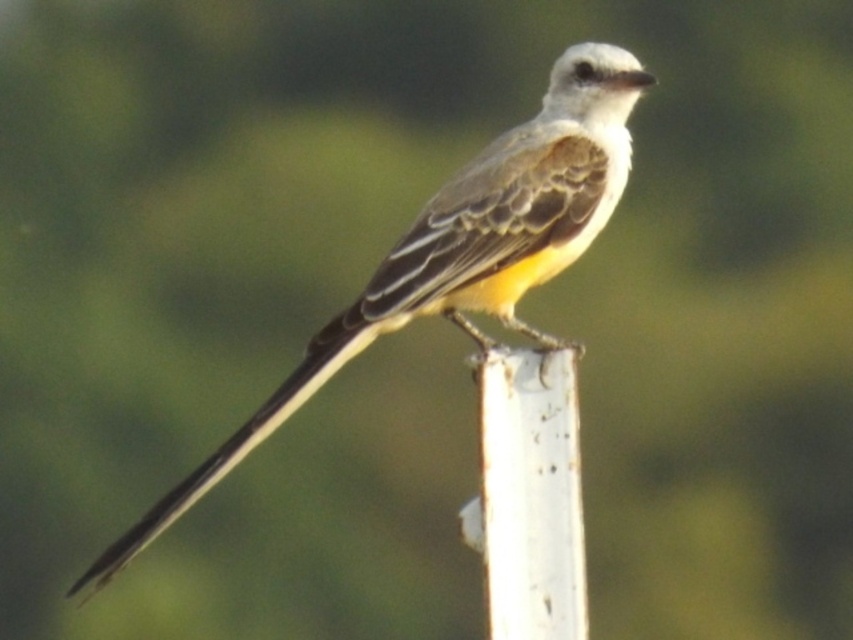
Question: Which point is farther to the camera?

Choices:
 (A) pyautogui.click(x=521, y=496)
 (B) pyautogui.click(x=219, y=460)

Answer: (A)

Question: In this image, where is yellow-brown feathers at center located relative to white weathered wood at center?

Choices:
 (A) left
 (B) right

Answer: (B)

Question: Can you confirm if yellow-brown feathers at center is positioned to the left of white weathered wood at center?

Choices:
 (A) yes
 (B) no

Answer: (B)

Question: Is yellow-brown feathers at center positioned in front of white weathered wood at center?

Choices:
 (A) yes
 (B) no

Answer: (B)

Question: Which point is closer to the camera?

Choices:
 (A) yellow-brown feathers at center
 (B) white weathered wood at center

Answer: (B)